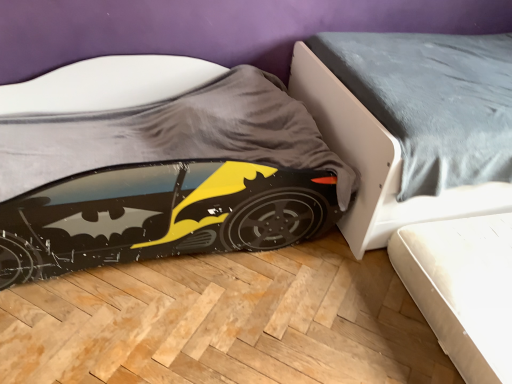
Question: Relative to smooth gray bed at lower right, is matt black batmobile at lower left in front or behind?

Choices:
 (A) behind
 (B) front

Answer: (B)

Question: Would you say matt black batmobile at lower left is to the left or to the right of smooth gray bed at lower right in the picture?

Choices:
 (A) right
 (B) left

Answer: (B)

Question: From a real-world perspective, is matt black batmobile at lower left physically located above or below smooth gray bed at lower right?

Choices:
 (A) above
 (B) below

Answer: (B)

Question: From a real-world perspective, is smooth gray bed at lower right physically located above or below matt black batmobile at lower left?

Choices:
 (A) below
 (B) above

Answer: (B)

Question: Is smooth gray bed at lower right bigger or smaller than matt black batmobile at lower left?

Choices:
 (A) big
 (B) small

Answer: (A)

Question: Is smooth gray bed at lower right taller or shorter than matt black batmobile at lower left?

Choices:
 (A) tall
 (B) short

Answer: (A)

Question: From the image's perspective, relative to matt black batmobile at lower left, is smooth gray bed at lower right above or below?

Choices:
 (A) above
 (B) below

Answer: (A)